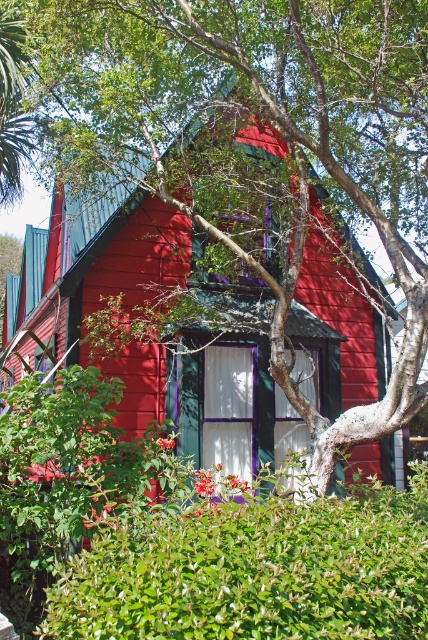
You are a gardener standing in front of the house. You notice the green leafy hedge at center and the matte wood house at center. Which object is closer to you?

The green leafy hedge at center is closer to you because it is in front of the matte wood house at center.